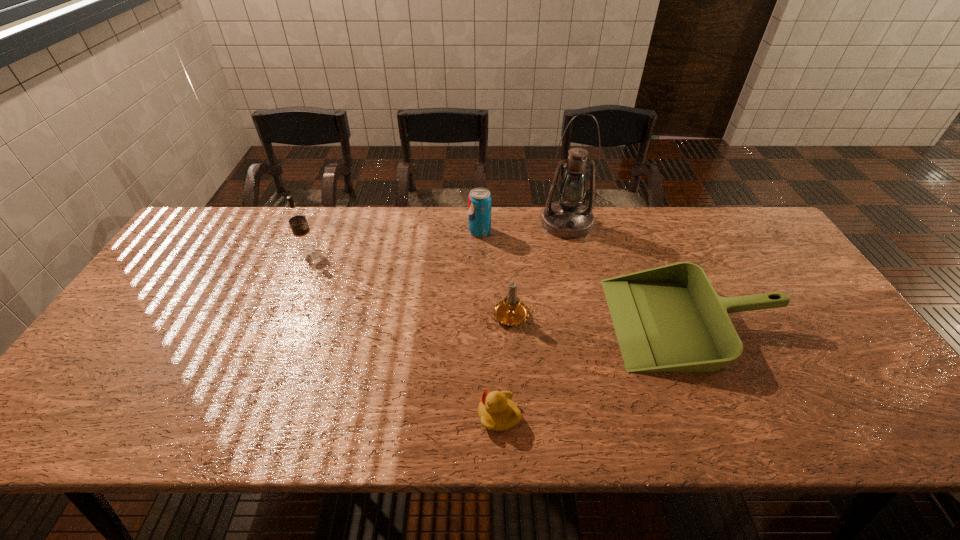
The height and width of the screenshot is (540, 960). In order to click on soda can that is at the far edge in this screenshot , I will do `click(479, 200)`.

Image resolution: width=960 pixels, height=540 pixels. What are the coordinates of `object situated at the near edge` in the screenshot? It's located at (497, 411).

Where is `free region at the far edge of the desktop`? The image size is (960, 540). free region at the far edge of the desktop is located at coordinates (624, 245).

Locate an element on the screen. Image resolution: width=960 pixels, height=540 pixels. free space at the near edge of the desktop is located at coordinates (157, 406).

Find the location of a particular element. The image size is (960, 540). vacant space at the left edge of the desktop is located at coordinates (196, 266).

Find the location of `vacant space at the far left corner of the desktop`. vacant space at the far left corner of the desktop is located at coordinates (218, 224).

In the image, there is a desktop. Where is `vacant space at the far right corner`? The width and height of the screenshot is (960, 540). vacant space at the far right corner is located at coordinates (746, 238).

The height and width of the screenshot is (540, 960). I want to click on vacant area that lies between the vodka and the third shortest object, so click(411, 282).

Locate an element on the screen. This screenshot has width=960, height=540. vacant area that lies between the third tallest object and the vodka is located at coordinates (394, 240).

Locate an element on the screen. Image resolution: width=960 pixels, height=540 pixels. free space between the duckling and the dustpan is located at coordinates (596, 368).